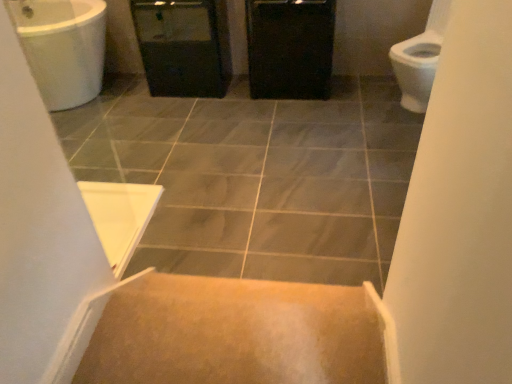
Question: Is gray tile at center to the left or to the right of black matte cabinet at center in the image?

Choices:
 (A) left
 (B) right

Answer: (A)

Question: Considering the positions of gray tile at center and black matte cabinet at center in the image, is gray tile at center wider or thinner than black matte cabinet at center?

Choices:
 (A) thin
 (B) wide

Answer: (B)

Question: Considering the real-world distances, which object is closest to the black plastic screen door at center?

Choices:
 (A) carpeted stairs at center
 (B) black matte cabinet at center
 (C) gray tile at center

Answer: (B)

Question: Which object is positioned closest to the carpeted stairs at center?

Choices:
 (A) black matte cabinet at center
 (B) black plastic screen door at center
 (C) gray tile at center

Answer: (C)